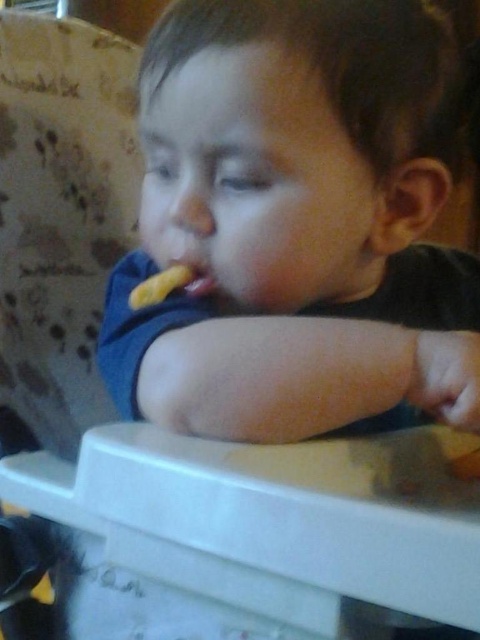
Can you confirm if yellow matte food at mouth is bigger than pink matte lips at center?

Correct, yellow matte food at mouth is larger in size than pink matte lips at center.

Is yellow matte food at mouth wider than pink matte lips at center?

Yes, yellow matte food at mouth is wider than pink matte lips at center.

Does point (172, 273) lie behind point (205, 276)?

No, (172, 273) is in front of (205, 276).

Where is `yellow matte food at mouth`? Image resolution: width=480 pixels, height=640 pixels. yellow matte food at mouth is located at coordinates (159, 285).

Does smooth blue shirt at center appear on the right side of yellow matte food at mouth?

Indeed, smooth blue shirt at center is positioned on the right side of yellow matte food at mouth.

Find the location of a particular element. smooth blue shirt at center is located at coordinates (298, 224).

Does smooth blue shirt at center have a greater height compared to pink matte lips at center?

Correct, smooth blue shirt at center is much taller as pink matte lips at center.

Which is above, smooth blue shirt at center or pink matte lips at center?

smooth blue shirt at center is higher up.

Between point (350, 168) and point (179, 272), which one is positioned in front?

Point (350, 168) is in front.

Find the location of a particular element. This screenshot has height=640, width=480. smooth blue shirt at center is located at coordinates (298, 224).